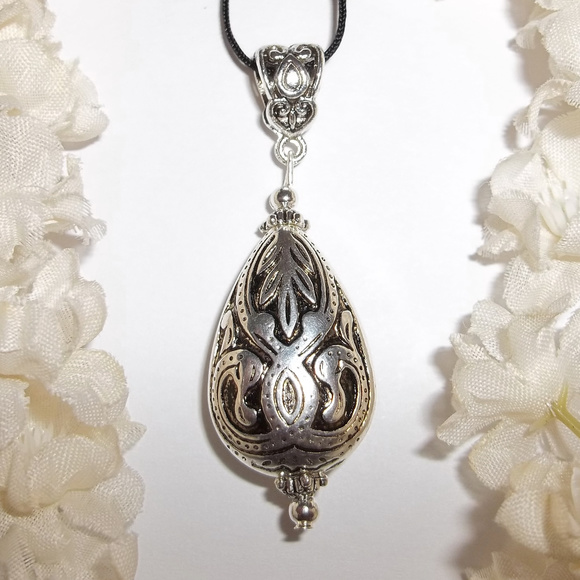
At what (x,y) coordinates should I click in order to perform the action: click on bulb. Please return your answer as a coordinate pair (x, y). The width and height of the screenshot is (580, 580). Looking at the image, I should click on (306, 510).